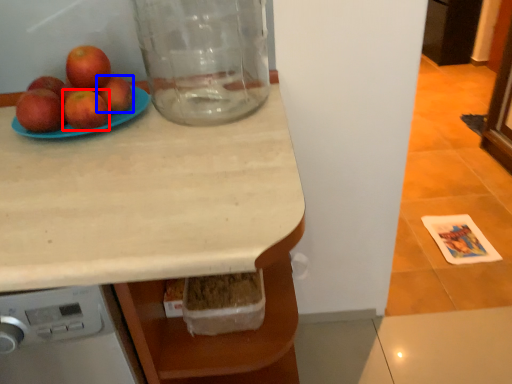
Question: Which point is further to the camera, apple (highlighted by a red box) or apple (highlighted by a blue box)?

Choices:
 (A) apple
 (B) apple

Answer: (B)